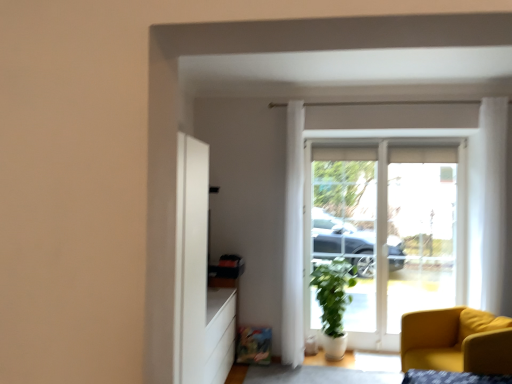
Where is `matte yellow armchair at lower right`? matte yellow armchair at lower right is located at coordinates (453, 344).

What do you see at coordinates (493, 199) in the screenshot?
I see `white sheer curtain at upper right, the first curtain positioned from the right` at bounding box center [493, 199].

Where is `white glass door at center`? The height and width of the screenshot is (384, 512). white glass door at center is located at coordinates (390, 231).

Find the location of a particular element. This screenshot has width=512, height=384. matte yellow armchair at lower right is located at coordinates (453, 344).

Looking at this image, from the image's perspective, who appears lower, matte yellow armchair at lower right or white glass door at center?

matte yellow armchair at lower right.

From a real-world perspective, is matte yellow armchair at lower right beneath white glass door at center?

Indeed, from a real-world perspective, matte yellow armchair at lower right is positioned beneath white glass door at center.

In the scene shown: Which is behind, matte yellow armchair at lower right or white glass door at center?

white glass door at center is further from the camera.

Is matte yellow armchair at lower right directly adjacent to white glass door at center?

matte yellow armchair at lower right and white glass door at center are not in contact.

Is white sheer curtain at upper right, the first curtain positioned from the right, in front of or behind green matte plant at center in the image?

In the image, white sheer curtain at upper right, the first curtain positioned from the right, appears in front of green matte plant at center.

Does point (495, 119) come farther from viewer compared to point (332, 305)?

No, (495, 119) is in front of (332, 305).

Considering the sizes of white sheer curtain at upper right, the first curtain positioned from the right, and green matte plant at center in the image, is white sheer curtain at upper right, the first curtain positioned from the right, wider or thinner than green matte plant at center?

Considering their sizes, white sheer curtain at upper right, the first curtain positioned from the right, looks slimmer than green matte plant at center.

From the image's perspective, which is above, white sheer curtain at upper right, the second curtain from the back, or green matte plant at center?

white sheer curtain at upper right, the second curtain from the back, from the image's perspective.

Who is taller, green matte plant at center or matte yellow armchair at lower right?

green matte plant at center is taller.

How many degrees apart are the facing directions of green matte plant at center and matte yellow armchair at lower right?

There is a 60.9-degree angle between the facing directions of green matte plant at center and matte yellow armchair at lower right.

Consider the image. From the image's perspective, between green matte plant at center and matte yellow armchair at lower right, who is located below?

matte yellow armchair at lower right, from the image's perspective.

Would you say matte yellow armchair at lower right is to the left or to the right of white sheer curtain at center, the first curtain from the back, in the picture?

matte yellow armchair at lower right is to the right of white sheer curtain at center, the first curtain from the back.

From the image's perspective, between matte yellow armchair at lower right and white sheer curtain at center, which appears as the second curtain when viewed from the right, which one is located above?

white sheer curtain at center, which appears as the second curtain when viewed from the right, appears higher in the image.

Looking at their sizes, would you say matte yellow armchair at lower right is wider or thinner than white sheer curtain at center, the first curtain from the back?

In the image, matte yellow armchair at lower right appears to be wider than white sheer curtain at center, the first curtain from the back.

Would you consider matte yellow armchair at lower right to be distant from white sheer curtain at center, arranged as the first curtain when viewed from the left?

Yes, matte yellow armchair at lower right is far from white sheer curtain at center, arranged as the first curtain when viewed from the left.

Based on the photo, from the image's perspective, does white sheer curtain at upper right, which is the first curtain in front-to-back order, appear lower than white glass door at center?

Incorrect, from the image's perspective, white sheer curtain at upper right, which is the first curtain in front-to-back order, is higher than white glass door at center.

Would you consider white sheer curtain at upper right, which is the second curtain in left-to-right order, to be distant from white glass door at center?

No, white sheer curtain at upper right, which is the second curtain in left-to-right order, is in close proximity to white glass door at center.

Between point (482, 99) and point (375, 338), which one is positioned in front?

Positioned in front is point (482, 99).

Is white sheer curtain at upper right, the first curtain positioned from the right, surrounding white glass door at center?

That's incorrect, white glass door at center is not inside white sheer curtain at upper right, the first curtain positioned from the right.

Considering the sizes of objects white glass door at center and white sheer curtain at upper right, the second curtain from the back, in the image provided, who is bigger, white glass door at center or white sheer curtain at upper right, the second curtain from the back,?

Bigger between the two is white glass door at center.

Looking at this image, can you confirm if white glass door at center is positioned to the left of white sheer curtain at upper right, which is the second curtain in left-to-right order?

Yes, white glass door at center is to the left of white sheer curtain at upper right, which is the second curtain in left-to-right order.

Is white glass door at center taller than white sheer curtain at upper right, the second curtain from the back?

Correct, white glass door at center is much taller as white sheer curtain at upper right, the second curtain from the back.

Is white glass door at center beside white sheer curtain at upper right, which is the first curtain in front-to-back order?

No, white glass door at center is not making contact with white sheer curtain at upper right, which is the first curtain in front-to-back order.

At what (x,y) coordinates should I click in order to perform the action: click on curtain on the right of the green matte plant at center. Please return your answer as a coordinate pair (x, y). Looking at the image, I should click on (493, 199).

Could you tell me if green matte plant at center is facing white sheer curtain at upper right, which is the first curtain in front-to-back order?

No, green matte plant at center is not oriented towards white sheer curtain at upper right, which is the first curtain in front-to-back order.

Who is bigger, green matte plant at center or white sheer curtain at upper right, the second curtain from the back?

green matte plant at center is bigger.

Who is more distant, green matte plant at center or white sheer curtain at upper right, the first curtain positioned from the right?

green matte plant at center is further from the camera.

This screenshot has width=512, height=384. In order to click on chair in front of the white glass door at center in this screenshot , I will do `click(453, 344)`.

Identify the location of houseplant behind the white sheer curtain at upper right, which is the second curtain in left-to-right order. (333, 303).

When comparing their distances from white sheer curtain at upper right, the second curtain from the back, does white glass door at center or matte yellow armchair at lower right seem further?

white glass door at center is further to white sheer curtain at upper right, the second curtain from the back.

From the image, which object appears to be farther from white glass door at center, white sheer curtain at center, the first curtain from the back, or white sheer curtain at upper right, which is the first curtain in front-to-back order?

The object further to white glass door at center is white sheer curtain at center, the first curtain from the back.

When comparing their distances from white glass door at center, does matte yellow armchair at lower right or green matte plant at center seem further?

matte yellow armchair at lower right is positioned further to the anchor white glass door at center.

When comparing their distances from green matte plant at center, does white sheer curtain at center, arranged as the first curtain when viewed from the left, or matte yellow armchair at lower right seem further?

Based on the image, matte yellow armchair at lower right appears to be further to green matte plant at center.

Considering their positions, is white sheer curtain at upper right, the first curtain positioned from the right, positioned further to white glass door at center than green matte plant at center?

white sheer curtain at upper right, the first curtain positioned from the right, lies further to white glass door at center than the other object.

Which object lies further to the anchor point matte yellow armchair at lower right, green matte plant at center or white sheer curtain at upper right, which is the second curtain in left-to-right order?

green matte plant at center is positioned further to the anchor matte yellow armchair at lower right.

Looking at the image, which one is located further to white sheer curtain at center, which appears as the second curtain when viewed from the right, green matte plant at center or white sheer curtain at upper right, which is the first curtain in front-to-back order?

white sheer curtain at upper right, which is the first curtain in front-to-back order, is positioned further to the anchor white sheer curtain at center, which appears as the second curtain when viewed from the right.

Which object lies nearer to the anchor point white glass door at center, white sheer curtain at upper right, which is the first curtain in front-to-back order, or white sheer curtain at center, arranged as the first curtain when viewed from the left?

Based on the image, white sheer curtain at upper right, which is the first curtain in front-to-back order, appears to be nearer to white glass door at center.

In order to click on chair between white sheer curtain at center, the first curtain from the back, and white sheer curtain at upper right, the second curtain from the back, from left to right in this screenshot , I will do `click(453, 344)`.

Find the location of a particular element. This screenshot has height=384, width=512. houseplant between matte yellow armchair at lower right and white glass door at center in the front-back direction is located at coordinates (333, 303).

Find the location of `houseplant between white sheer curtain at center, which appears as the second curtain when viewed from the right, and white sheer curtain at upper right, the second curtain from the back, from left to right`. houseplant between white sheer curtain at center, which appears as the second curtain when viewed from the right, and white sheer curtain at upper right, the second curtain from the back, from left to right is located at coordinates (333, 303).

Where is `houseplant between white sheer curtain at center, arranged as the second curtain when viewed from the front, and white glass door at center`? houseplant between white sheer curtain at center, arranged as the second curtain when viewed from the front, and white glass door at center is located at coordinates (333, 303).